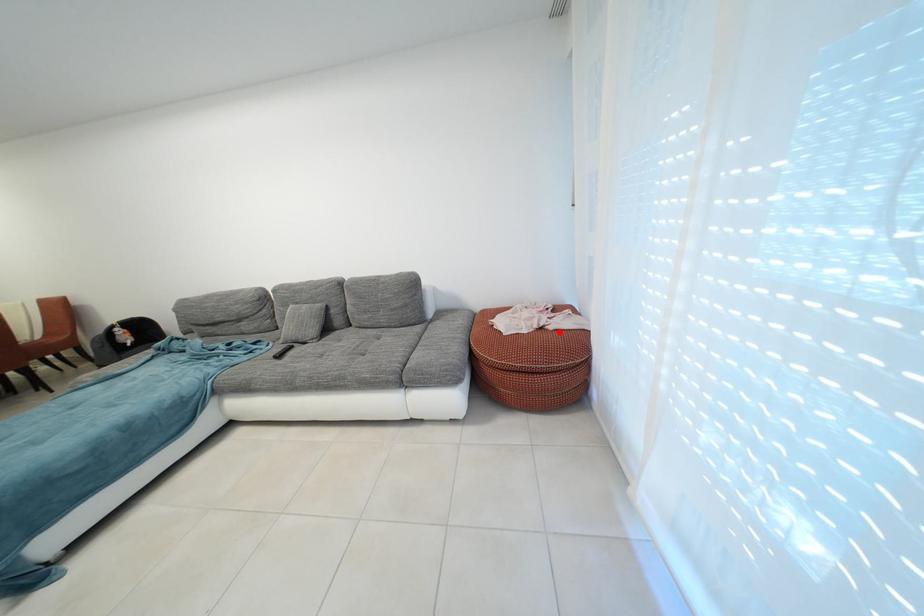
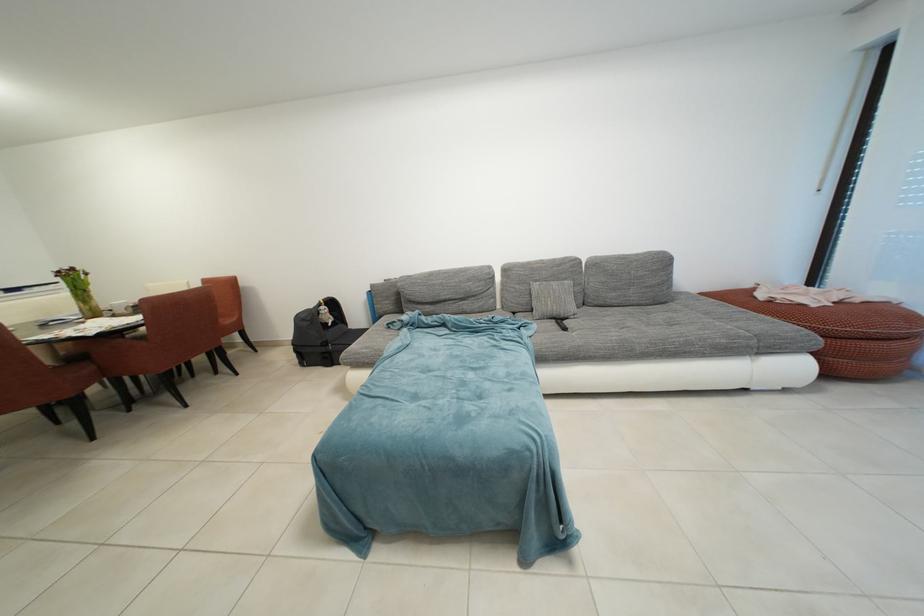
Question: I am providing you with two images of the same scene from different viewpoints. Given a red point in image1, look at the same physical point in image2. Is it:

Choices:
 (A) Closer to the viewpoint
 (B) Farther from the viewpoint

Answer: (B)